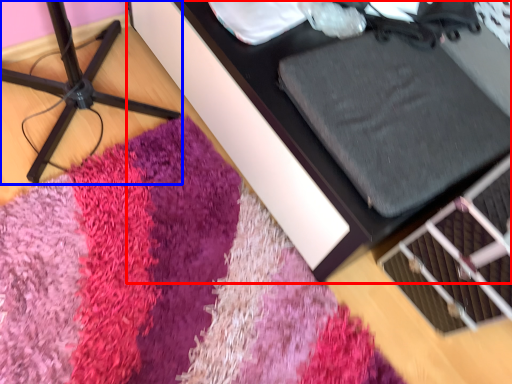
Question: Among these objects, which one is nearest to the camera, furniture (highlighted by a red box) or furniture (highlighted by a blue box)?

Choices:
 (A) furniture
 (B) furniture

Answer: (B)